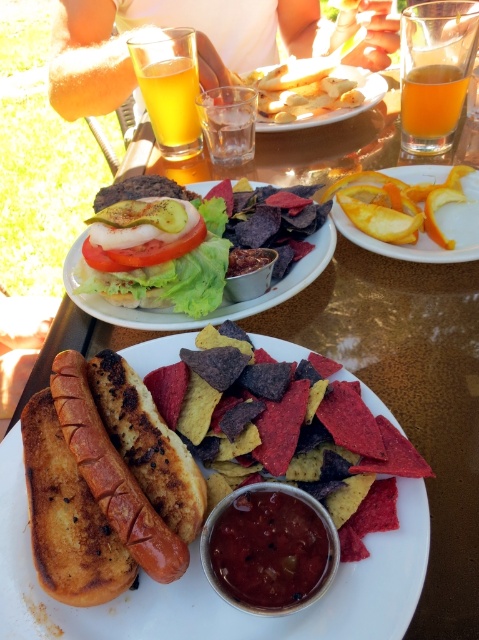
Question: Does grilled bread hot dog at center have a greater width compared to golden crispy fries at center?

Choices:
 (A) no
 (B) yes

Answer: (A)

Question: Which of the following is the closest to the observer?

Choices:
 (A) translucent glass of orange juice at upper center
 (B) grilled bread at center
 (C) grilled bread hot dog at center
 (D) orange peel at upper right

Answer: (B)

Question: Considering the real-world distances, which object is closest to the grilled bread hot dog at center?

Choices:
 (A) orange peel at upper right
 (B) golden crispy fries at center

Answer: (A)

Question: Considering the real-world distances, which object is closest to the translucent glass at upper right?

Choices:
 (A) orange peel at upper right
 (B) grilled bread hot dog at center
 (C) golden crispy fries at center

Answer: (A)

Question: Does smokey red paste at center have a greater width compared to translucent glass of orange juice at upper center?

Choices:
 (A) no
 (B) yes

Answer: (A)

Question: In this image, where is grilled bread hot dog at center located relative to translucent glass at upper right?

Choices:
 (A) above
 (B) below

Answer: (B)